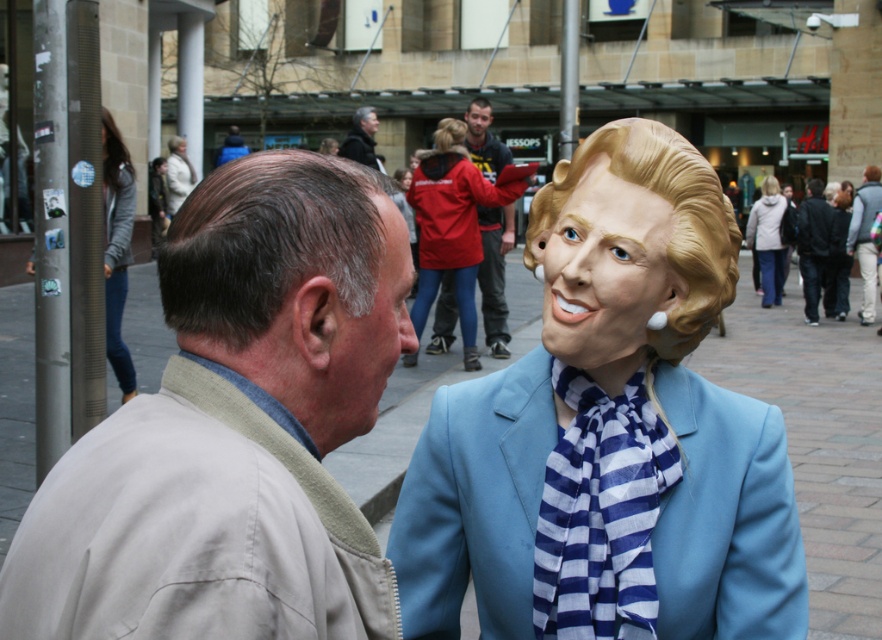
What is the color of the clothing worn by the person or object located at the coordinates point (475,502) in the image?

The point (475,502) indicates a blue fabric business suit at right.